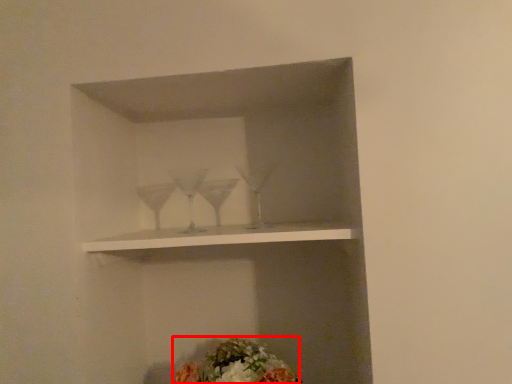
Question: Where is flower (annotated by the red box) located in relation to shelf in the image?

Choices:
 (A) left
 (B) right

Answer: (B)